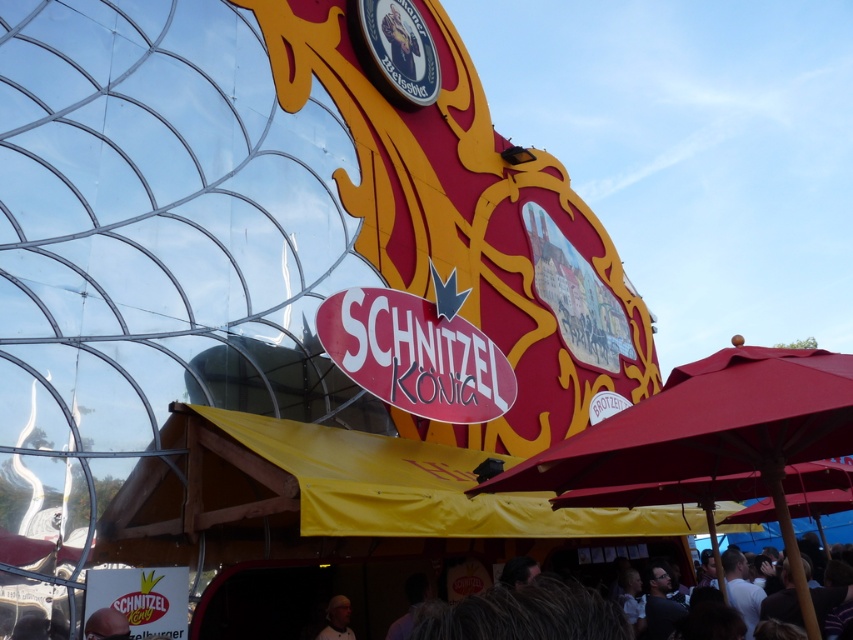
You are a photographer at the festival and want to capture both the matte black helmet at lower left and the white matte hair at lower center in a single shot. Which object should you position closer to the left edge of your camera frame to ensure both are visible?

The matte black helmet at lower left should be positioned closer to the left edge of your camera frame since it is already on the left side of the white matte hair at lower center.

You are standing at the entrance of the food stall and see the point marked at coordinates (712, 433). Which object is this point located on?

The point marked at coordinates (712, 433) is located on the matte red umbrella at lower right.

You are at the festival and need to decide which item to take with you. The matte red umbrella at lower right is smaller than the matte black helmet at lower left. Which item takes up more space?

The matte black helmet at lower left takes up more space because it is larger than the matte red umbrella at lower right.